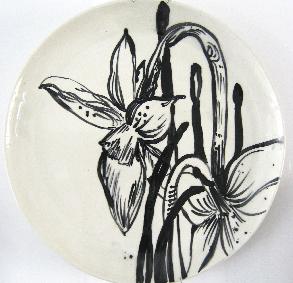
Locate an element on the screen. plate is located at coordinates (56, 55).